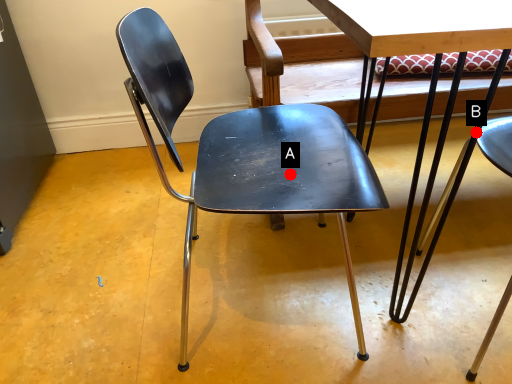
Question: Two points are circled on the image, labeled by A and B beside each circle. Among these points, which one is nearest to the camera?

Choices:
 (A) A is closer
 (B) B is closer

Answer: (A)